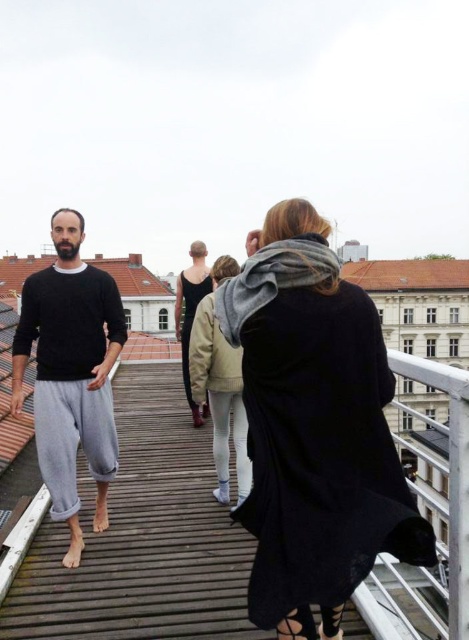
Can you confirm if brown tile roof at upper center is positioned to the right of black matte dress at center?

Correct, you'll find brown tile roof at upper center to the right of black matte dress at center.

Does brown tile roof at upper center appear on the left side of black matte dress at center?

No, brown tile roof at upper center is not to the left of black matte dress at center.

Is point (421, 266) positioned after point (205, 403)?

Yes, it is behind point (205, 403).

Where is `brown tile roof at upper center`? brown tile roof at upper center is located at coordinates (408, 275).

Between black cotton sweater at left and light beige sweater at center, which one has less height?

With less height is light beige sweater at center.

Can you confirm if black cotton sweater at left is positioned below light beige sweater at center?

Correct, black cotton sweater at left is located below light beige sweater at center.

Who is more distant from viewer, (83,276) or (224,394)?

The point (224,394) is behind.

Locate an element on the screen. This screenshot has height=640, width=469. black cotton sweater at left is located at coordinates (70, 372).

Locate an element on the screen. This screenshot has height=640, width=469. black cotton sweater at left is located at coordinates (70, 372).

Can you confirm if black cotton sweater at left is positioned below brown tile roof at upper center?

Indeed, black cotton sweater at left is positioned under brown tile roof at upper center.

Between point (22, 328) and point (396, 262), which one is positioned in front?

Point (22, 328) is in front.

In order to click on black cotton sweater at left in this screenshot , I will do `click(70, 372)`.